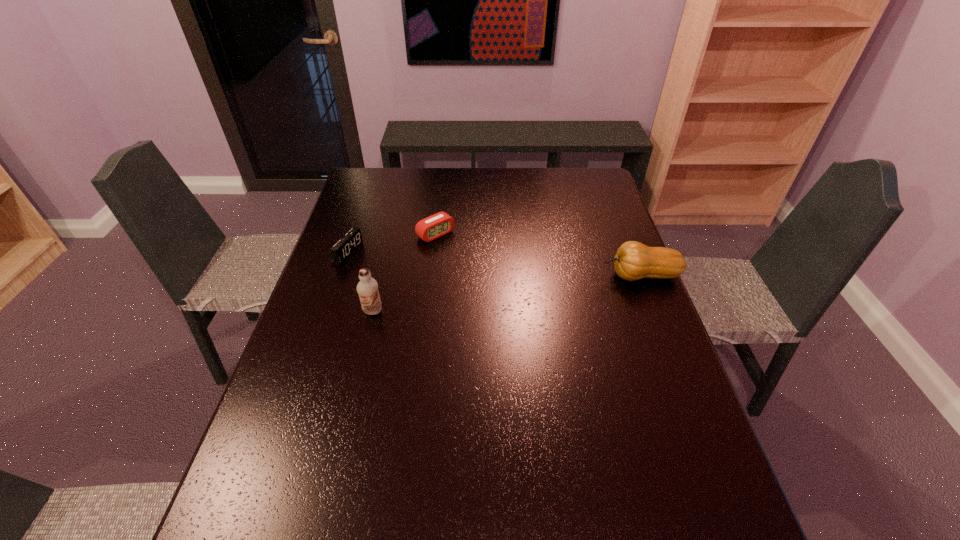
Locate an element on the screen. The height and width of the screenshot is (540, 960). vacant space located 0.380m on the front-facing side of the second object from right to left is located at coordinates (528, 311).

The width and height of the screenshot is (960, 540). I want to click on free spot located on the front-facing side of the second object from right to left, so click(518, 302).

This screenshot has height=540, width=960. I want to click on blank area located on the front-facing side of the second object from right to left, so click(x=491, y=279).

Identify the location of vacant region located on the front-facing side of the leftmost object. (468, 292).

Identify the location of free location located 0.090m on the front-facing side of the leftmost object. The image size is (960, 540). (383, 266).

Where is `vacant space located 0.100m on the front-facing side of the leftmost object`? vacant space located 0.100m on the front-facing side of the leftmost object is located at coordinates (386, 267).

Where is `chocolate milk located at the left edge`? chocolate milk located at the left edge is located at coordinates (367, 288).

Where is `alarm clock that is at the left edge`? alarm clock that is at the left edge is located at coordinates 352,240.

Locate an element on the screen. The image size is (960, 540). object positioned at the right edge is located at coordinates (633, 261).

In the image, there is a desktop. Where is `vacant region at the far edge`? The width and height of the screenshot is (960, 540). vacant region at the far edge is located at coordinates (497, 194).